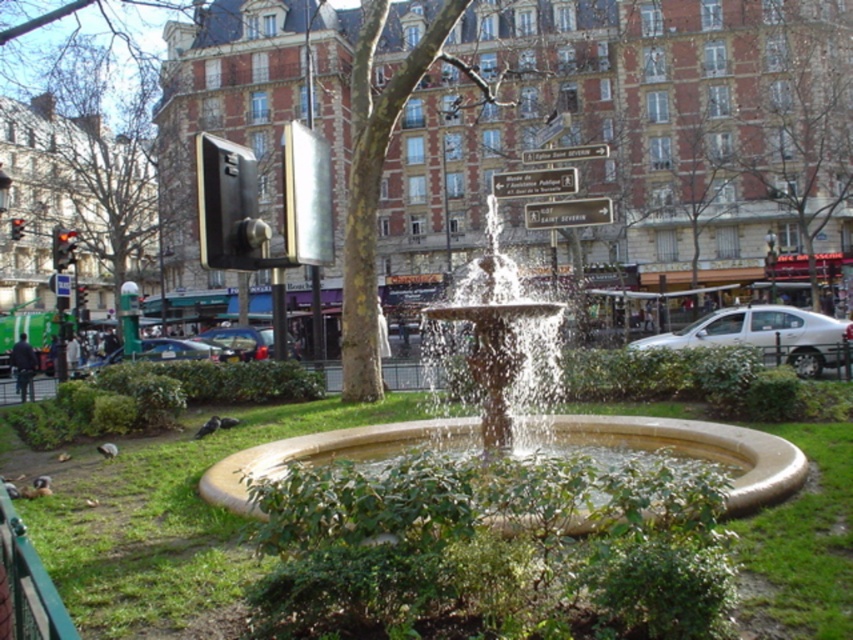
Question: Can you confirm if brown textured tree at center is thinner than smooth stone fountain at center?

Choices:
 (A) no
 (B) yes

Answer: (A)

Question: Where is bare wood tree at left located in relation to smooth stone fountain at center in the image?

Choices:
 (A) above
 (B) below

Answer: (A)

Question: Which of the following is the closest to the observer?

Choices:
 (A) (770, 145)
 (B) (335, 448)
 (C) (822, 595)

Answer: (C)

Question: Among these objects, which one is farthest from the camera?

Choices:
 (A) green grass at center
 (B) smooth stone fountain at center
 (C) brown textured tree at center

Answer: (C)

Question: Among these objects, which one is nearest to the camera?

Choices:
 (A) brown textured tree at center
 (B) smooth stone fountain at center

Answer: (B)

Question: Does green grass at center have a smaller size compared to brown textured tree at center?

Choices:
 (A) yes
 (B) no

Answer: (A)